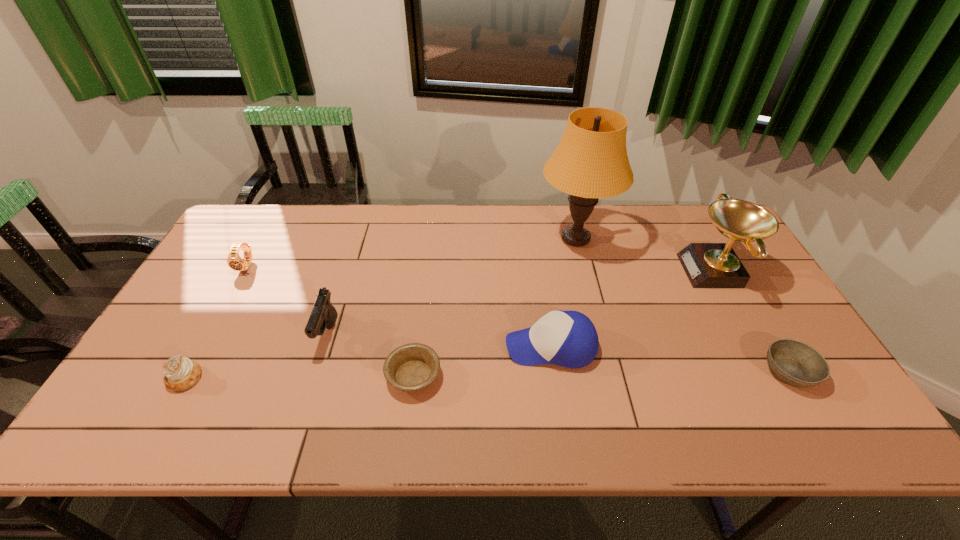
Where is `vacant region between the tallest object and the pastry`? Image resolution: width=960 pixels, height=540 pixels. vacant region between the tallest object and the pastry is located at coordinates (380, 308).

Identify the location of object that is the closest to the left bowl. Image resolution: width=960 pixels, height=540 pixels. (323, 315).

This screenshot has height=540, width=960. Identify the location of object that is the closest to the pistol. (412, 367).

I want to click on free region that satisfies the following two spatial constraints: 1. on the front side of the right bowl; 2. on the left side of the tallest object, so click(609, 372).

Where is `free location that satisfies the following two spatial constraints: 1. on the front-facing side of the award; 2. on the left side of the right bowl`? free location that satisfies the following two spatial constraints: 1. on the front-facing side of the award; 2. on the left side of the right bowl is located at coordinates coord(772,372).

The image size is (960, 540). What are the coordinates of `free location that satisfies the following two spatial constraints: 1. on the face of the watch; 2. on the right side of the fifth object from right to left` in the screenshot? It's located at (185, 376).

Find the location of `free space in the image that satisfies the following two spatial constraints: 1. on the front-facing side of the seventh shortest object; 2. at the barrel of the sixth object from right to left`. free space in the image that satisfies the following two spatial constraints: 1. on the front-facing side of the seventh shortest object; 2. at the barrel of the sixth object from right to left is located at coordinates (751, 334).

What are the coordinates of `vacant area in the image that satisfies the following two spatial constraints: 1. on the face of the left bowl; 2. on the right side of the watch` in the screenshot? It's located at (185, 376).